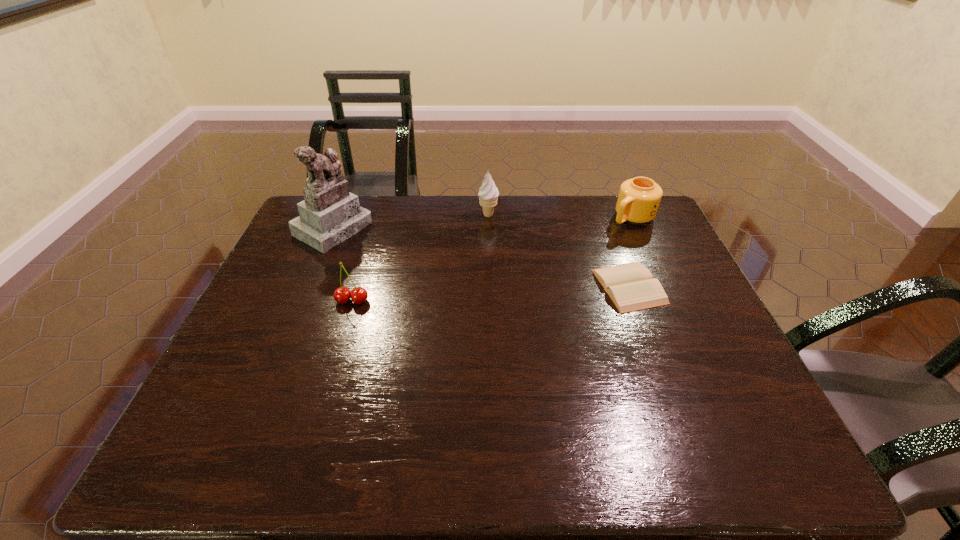
Select which object appears as the closest to the figurine. Please provide its 2D coordinates. Your answer should be formatted as a tuple, i.e. [(x, y)], where the tuple contains the x and y coordinates of a point satisfying the conditions above.

[(358, 295)]

You are a GUI agent. You are given a task and a screenshot of the screen. Output one action in this format:
    pyautogui.click(x=<x>, y=<y>)
    Task: Click on the object that is the second closest to the mug
    The height and width of the screenshot is (540, 960).
    Given the screenshot: What is the action you would take?
    pyautogui.click(x=488, y=194)

The width and height of the screenshot is (960, 540). Identify the location of vacant space that satisfies the following two spatial constraints: 1. on the front side of the diary; 2. on the left side of the tallest object. (309, 286).